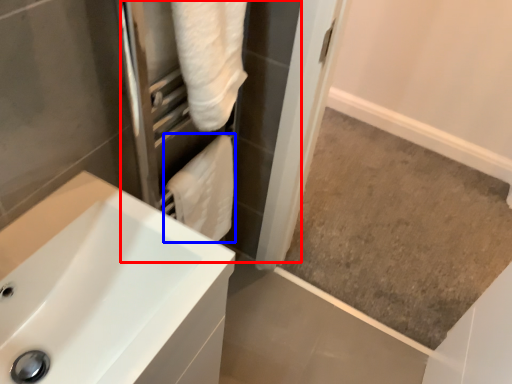
Question: Which object appears closest to the camera in this image, screen door (highlighted by a red box) or bath towel (highlighted by a blue box)?

Choices:
 (A) screen door
 (B) bath towel

Answer: (A)